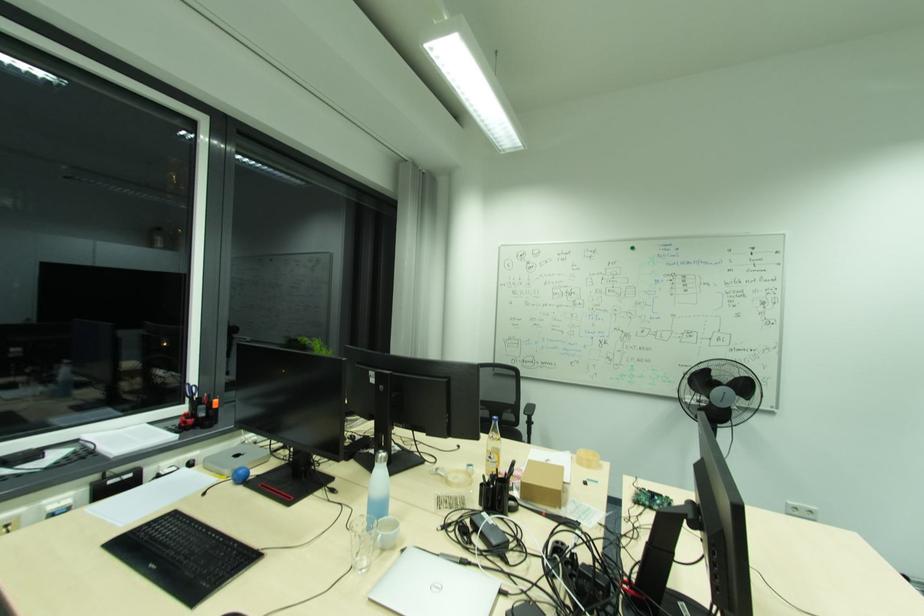
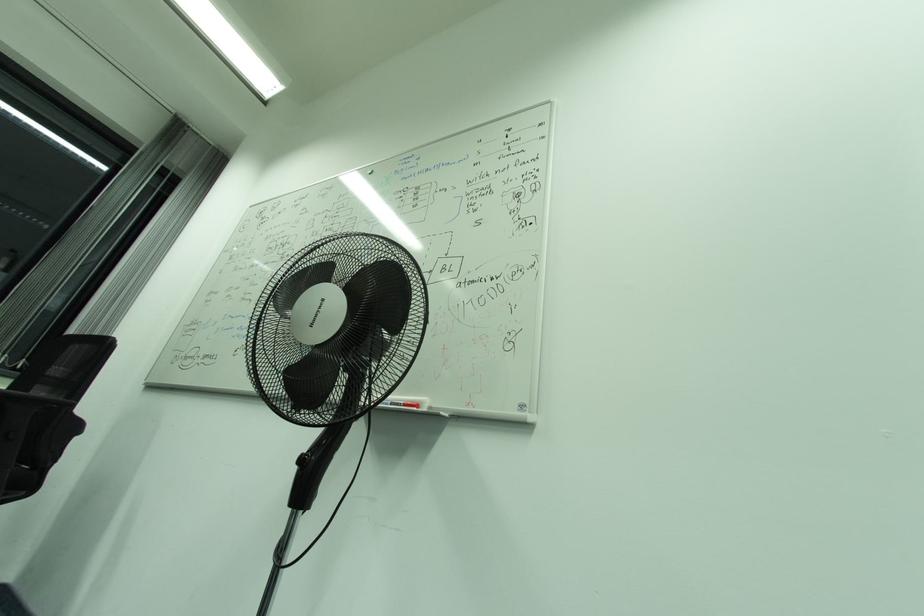
In a continuous first-person perspective shot, in which direction is the camera moving?

The cameraman moved toward right, forward.